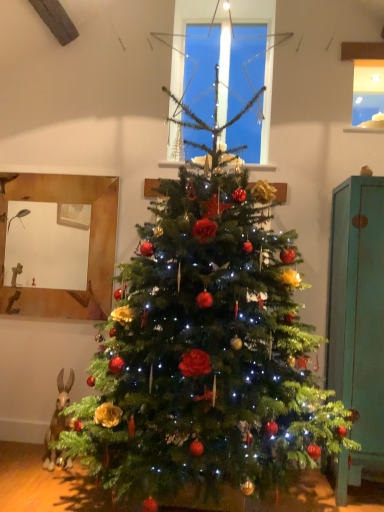
Question: From the image's perspective, relative to clear glass window at upper center, is teal wood cabinet at right above or below?

Choices:
 (A) above
 (B) below

Answer: (B)

Question: Choose the correct answer: Is teal wood cabinet at right inside clear glass window at upper center or outside it?

Choices:
 (A) outside
 (B) inside

Answer: (A)

Question: In terms of width, does teal wood cabinet at right look wider or thinner when compared to clear glass window at upper center?

Choices:
 (A) thin
 (B) wide

Answer: (B)

Question: From the image's perspective, relative to teal wood cabinet at right, is clear glass window at upper center above or below?

Choices:
 (A) below
 (B) above

Answer: (B)

Question: Do you think clear glass window at upper center is within teal wood cabinet at right, or outside of it?

Choices:
 (A) inside
 (B) outside

Answer: (B)

Question: Looking at their shapes, would you say clear glass window at upper center is wider or thinner than teal wood cabinet at right?

Choices:
 (A) wide
 (B) thin

Answer: (B)

Question: In terms of height, does clear glass window at upper center look taller or shorter compared to teal wood cabinet at right?

Choices:
 (A) tall
 (B) short

Answer: (B)